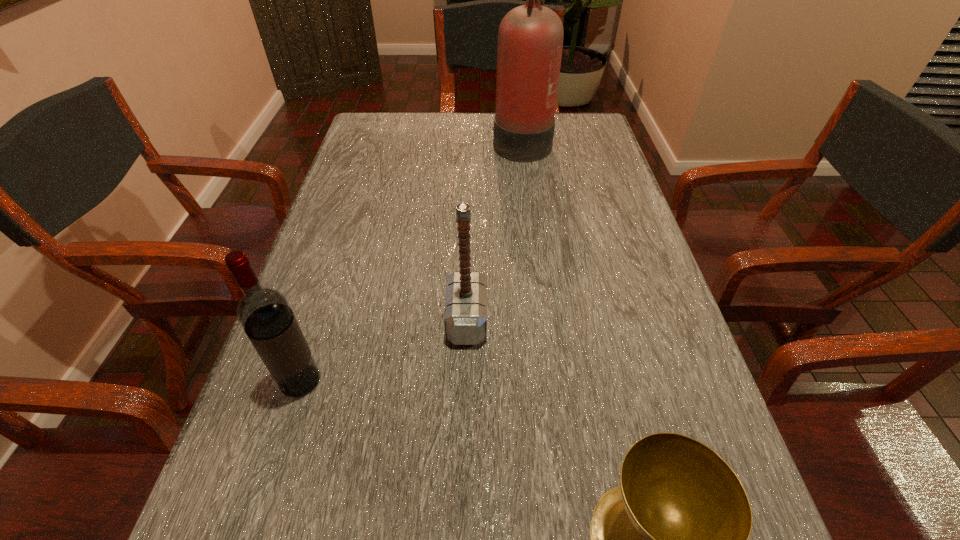
Locate an element on the screen. This screenshot has height=540, width=960. vacant space in between the fire extinguisher and the wine bottle is located at coordinates (411, 261).

Identify the location of vacant space in between the tallest object and the third farthest object. (411, 261).

What are the coordinates of `vacant space that is in between the third farthest object and the hammer` in the screenshot? It's located at (384, 350).

Find the location of a particular element. empty space between the farthest object and the second farthest object is located at coordinates (494, 230).

Image resolution: width=960 pixels, height=540 pixels. What are the coordinates of `free space that is in between the tallest object and the second farthest object` in the screenshot? It's located at (494, 230).

Locate an element on the screen. empty space that is in between the tallest object and the wine bottle is located at coordinates (411, 261).

This screenshot has height=540, width=960. What are the coordinates of `free point between the tallest object and the leftmost object` in the screenshot? It's located at (411, 261).

The height and width of the screenshot is (540, 960). In order to click on object that stands as the third closest to the leftmost object in this screenshot , I will do `click(530, 40)`.

Identify the location of object that can be found as the closest to the fire extinguisher. (465, 315).